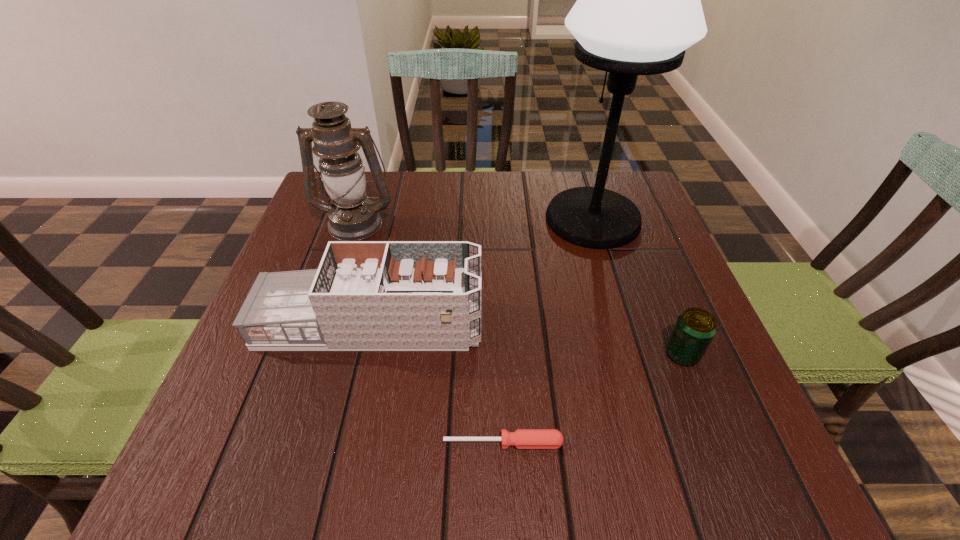
What are the coordinates of `free space located on the back of the shortest object` in the screenshot? It's located at (501, 401).

The image size is (960, 540). Identify the location of table lamp that is at the far edge. (638, 7).

Locate an element on the screen. oil lamp situated at the far edge is located at coordinates (352, 217).

You are a GUI agent. You are given a task and a screenshot of the screen. Output one action in this format:
    pyautogui.click(x=<x>, y=<y>)
    Task: Click on the object that is at the near edge
    The height and width of the screenshot is (540, 960).
    Given the screenshot: What is the action you would take?
    pyautogui.click(x=522, y=438)

The width and height of the screenshot is (960, 540). Find the location of `oil lamp that is at the left edge`. oil lamp that is at the left edge is located at coordinates (352, 217).

Image resolution: width=960 pixels, height=540 pixels. I want to click on dollhouse at the left edge, so click(x=365, y=295).

This screenshot has width=960, height=540. Find the location of `table lamp that is at the right edge`. table lamp that is at the right edge is located at coordinates (638, 7).

You are a GUI agent. You are given a task and a screenshot of the screen. Output one action in this format:
    pyautogui.click(x=<x>, y=<y>)
    Task: Click on the beer can that is at the right edge
    This screenshot has height=540, width=960.
    Given the screenshot: What is the action you would take?
    pyautogui.click(x=695, y=328)

You are a GUI agent. You are given a task and a screenshot of the screen. Output one action in this format:
    pyautogui.click(x=<x>, y=<y>)
    Task: Click on the object situated at the far left corner
    This screenshot has width=960, height=540.
    Given the screenshot: What is the action you would take?
    pyautogui.click(x=352, y=217)

At what (x,y) coordinates should I click in order to perform the action: click on object positioned at the far right corner. Please return your answer as a coordinate pair (x, y). Image resolution: width=960 pixels, height=540 pixels. Looking at the image, I should click on (638, 7).